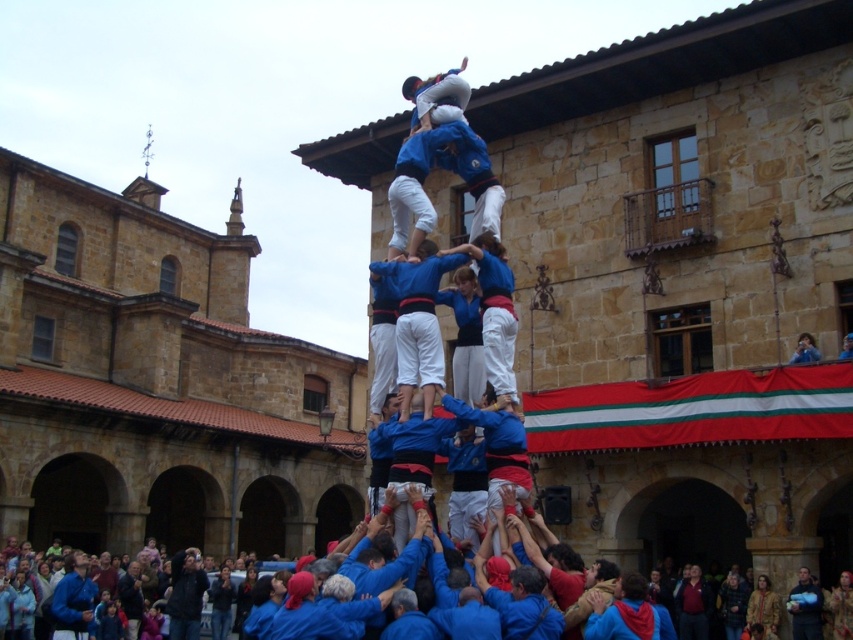
You are an event organizer planning to take a group photo of the participants in the courtyard. You notice the blue cotton shirt at center and the blue fabric person at center. Which of these two has a wider silhouette when viewed from the front?

A: The blue cotton shirt at center has a larger width than the blue fabric person at center, so the blue cotton shirt at center has a wider silhouette when viewed from the front.

You are a photographer standing at the camera position and want to capture a closeup of the blue cotton shirt at center. Given that your camera can focus on objects up to 20 meters away, will you be able to take the photo without moving closer?

The blue cotton shirt at center is 24.12 meters away from camera, which is beyond the camera focus range of 20 meters. Therefore, you cannot take a clear closeup without moving closer.

You are standing in the courtyard where the human tower is being built. You notice a specific point marked at coordinates point (396, 292). If you want to take a photo of this point from where you are standing, will you need to zoom in or out to capture it clearly?

The point (396, 292) is 26.03 meters away from the camera. Since this distance is relatively far, you will need to zoom in to capture it clearly.